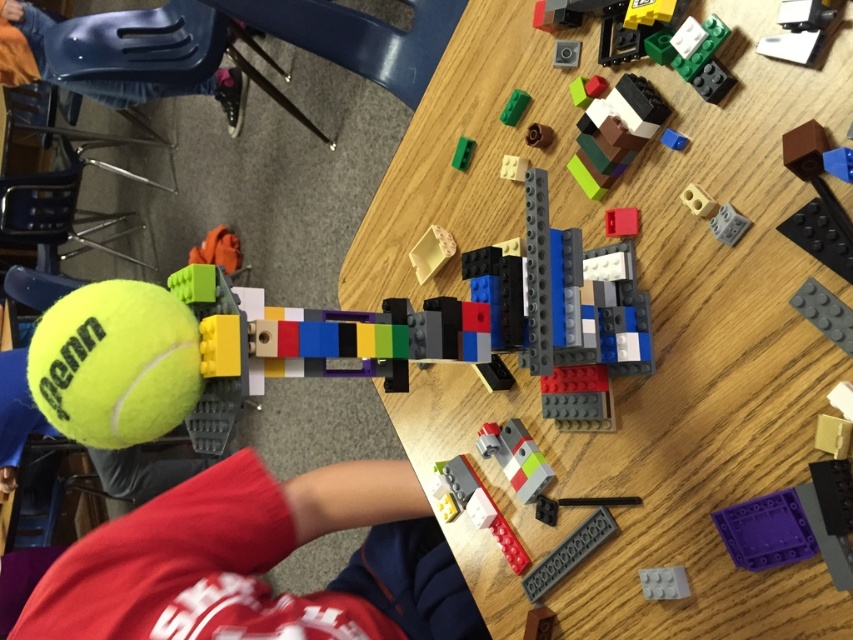
You are trying to place a new LEGO piece on the table. The translucent gray plastic at center is in the way. Can you move it to the side without touching the wooden table at center?

The wooden table at center is wider than the translucent gray plastic at center, so you can move the translucent gray plastic at center to the side of the wooden table at center without touching it.

You are organizing a toy cleanup. You have a storage bin that can only fit items wider than the green matte block at upper center. Can the yellow matte tennis ball at lower left fit in the bin?

The yellow matte tennis ball at lower left is wider than the green matte block at upper center, so it can fit in the storage bin designed for items wider than the green matte block at upper center.